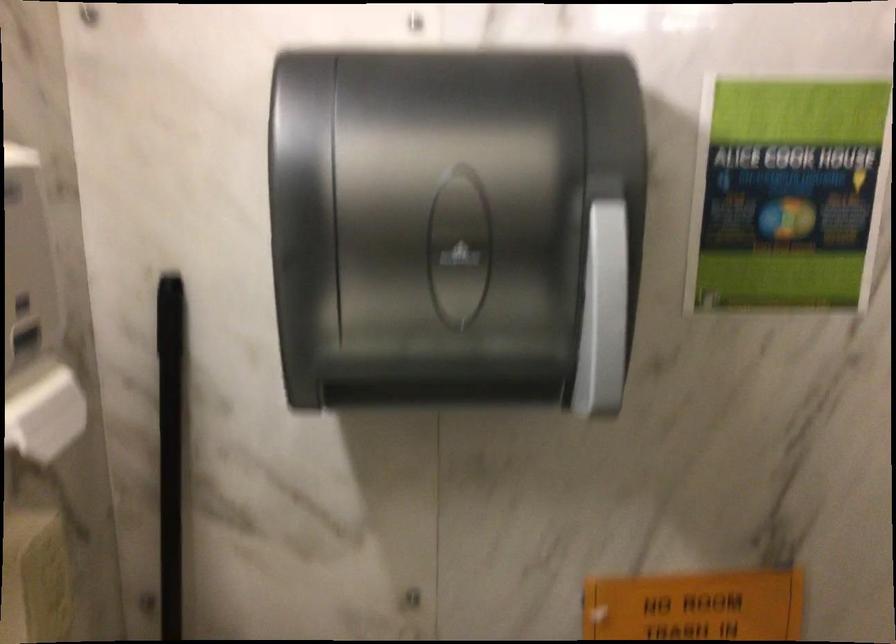
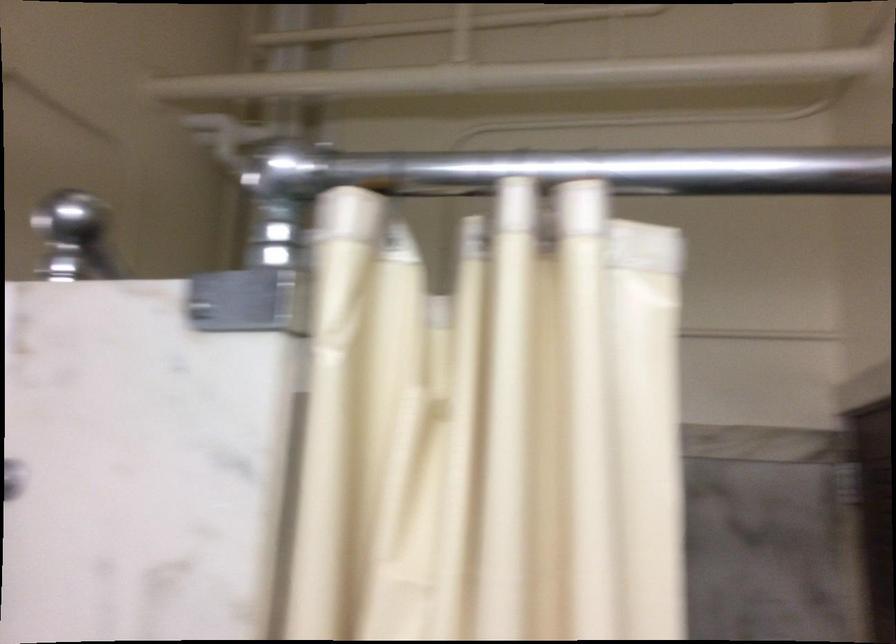
What movement of the cameraman would produce the second image?

The cameraman walked toward right, backward.